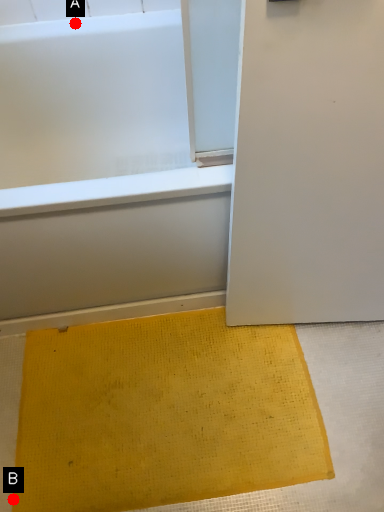
Question: Two points are circled on the image, labeled by A and B beside each circle. Which point is closer to the camera taking this photo?

Choices:
 (A) A is closer
 (B) B is closer

Answer: (B)